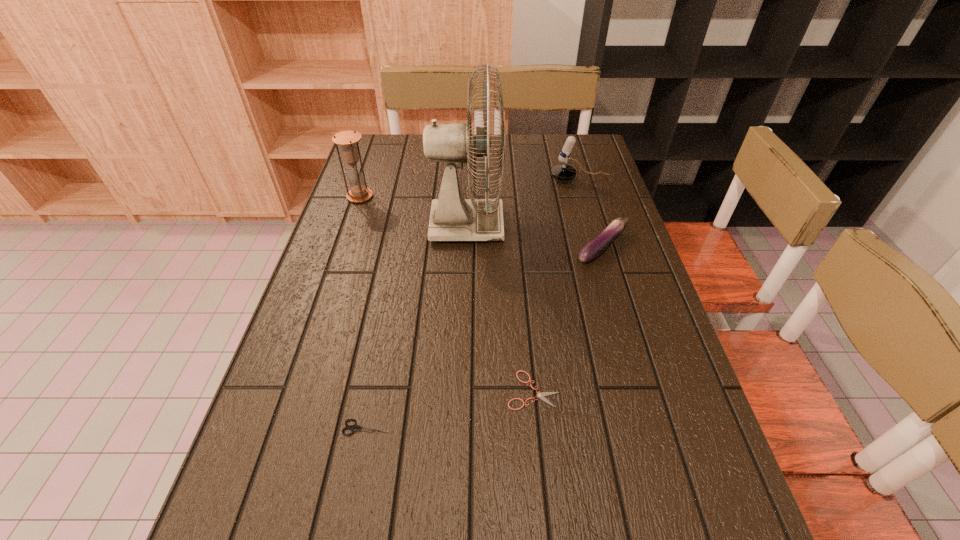
Find the location of a particular element. This screenshot has height=540, width=960. free space between the taller shears and the fifth farthest object is located at coordinates tap(450, 409).

This screenshot has width=960, height=540. I want to click on vacant area that lies between the third shortest object and the nearer shears, so click(485, 338).

The height and width of the screenshot is (540, 960). I want to click on vacant region between the eggplant and the fourth shortest object, so click(x=591, y=213).

Identify which object is the third closest to the eggplant. Please provide its 2D coordinates. Your answer should be formatted as a tuple, i.e. [(x, y)], where the tuple contains the x and y coordinates of a point satisfying the conditions above.

[(540, 395)]

I want to click on object that is the fourth nearest to the shorter shears, so click(563, 172).

I want to click on free space that satisfies the following two spatial constraints: 1. on the front side of the third tallest object; 2. on the front-facing side of the tallest object, so 594,226.

At what (x,y) coordinates should I click in order to perform the action: click on vacant position in the image that satisfies the following two spatial constraints: 1. on the back side of the third shortest object; 2. on the right side of the fifth farthest object. Please return your answer as a coordinate pair (x, y). This screenshot has height=540, width=960. Looking at the image, I should click on (519, 247).

Locate an element on the screen. This screenshot has width=960, height=540. free space that satisfies the following two spatial constraints: 1. on the back side of the fourth shortest object; 2. on the right side of the shortest object is located at coordinates (513, 179).